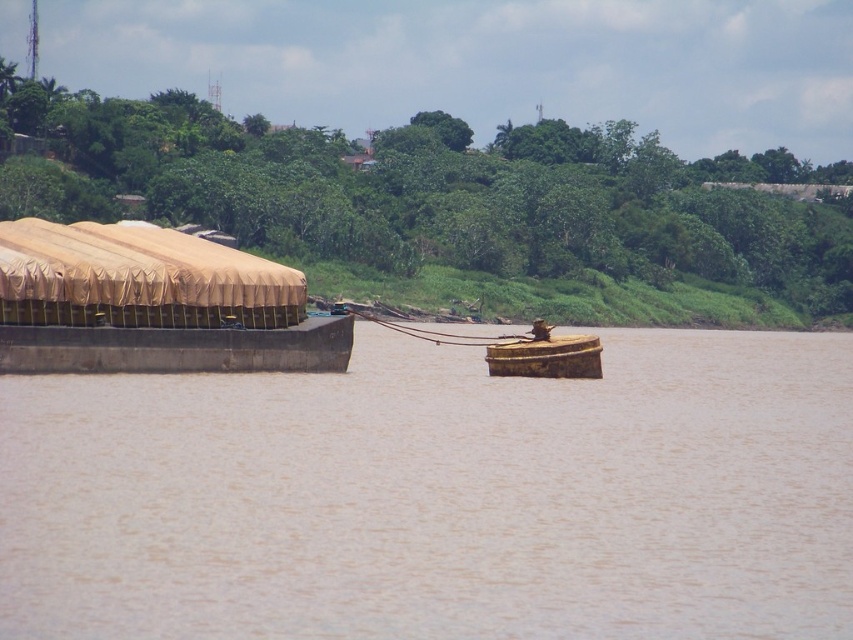
Can you confirm if brown matte barge at left is bigger than tan canvas boat at left?

Yes, brown matte barge at left is bigger than tan canvas boat at left.

Does brown matte barge at left appear on the right side of tan canvas boat at left?

Indeed, brown matte barge at left is positioned on the right side of tan canvas boat at left.

Describe the element at coordinates (439, 496) in the screenshot. Image resolution: width=853 pixels, height=640 pixels. I see `brown matte barge at left` at that location.

This screenshot has width=853, height=640. Find the location of `brown matte barge at left`. brown matte barge at left is located at coordinates (439, 496).